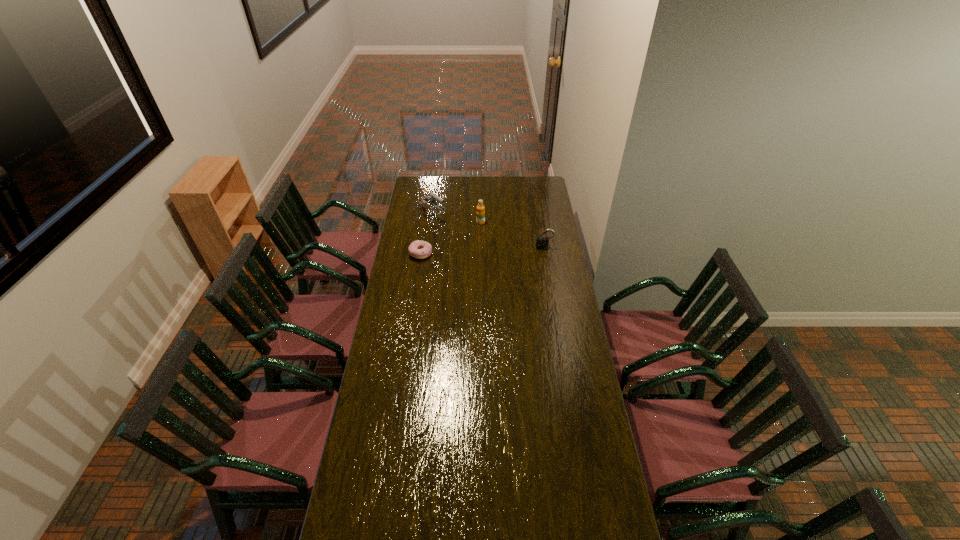
Where is `doughnut`? This screenshot has height=540, width=960. doughnut is located at coordinates (418, 249).

Find the location of `padlock`. padlock is located at coordinates (542, 242).

The width and height of the screenshot is (960, 540). I want to click on the rightmost object, so click(x=542, y=242).

This screenshot has width=960, height=540. In order to click on gun in this screenshot , I will do `click(431, 198)`.

In order to click on orange juice in this screenshot , I will do `click(480, 213)`.

Where is `free space located 0.200m on the back of the doughnut`? free space located 0.200m on the back of the doughnut is located at coordinates (425, 226).

Identify the location of free location located with the keyhole on the front of the second shortest object. The height and width of the screenshot is (540, 960). (550, 284).

Where is `vacant space located at the barrel end of the gun`? The image size is (960, 540). vacant space located at the barrel end of the gun is located at coordinates (455, 234).

This screenshot has height=540, width=960. I want to click on free space located at the barrel end of the gun, so click(464, 239).

This screenshot has width=960, height=540. Identify the location of free space located 0.240m at the barrel end of the gun. (468, 242).